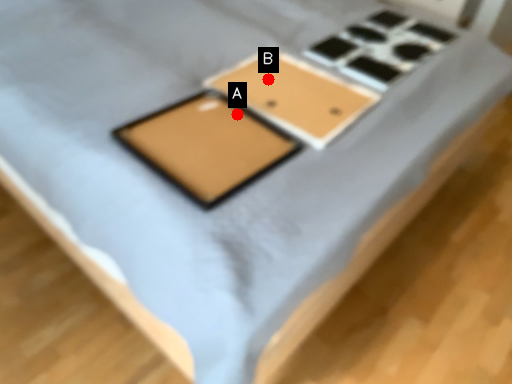
Question: Two points are circled on the image, labeled by A and B beside each circle. Which point appears closest to the camera in this image?

Choices:
 (A) A is closer
 (B) B is closer

Answer: (A)